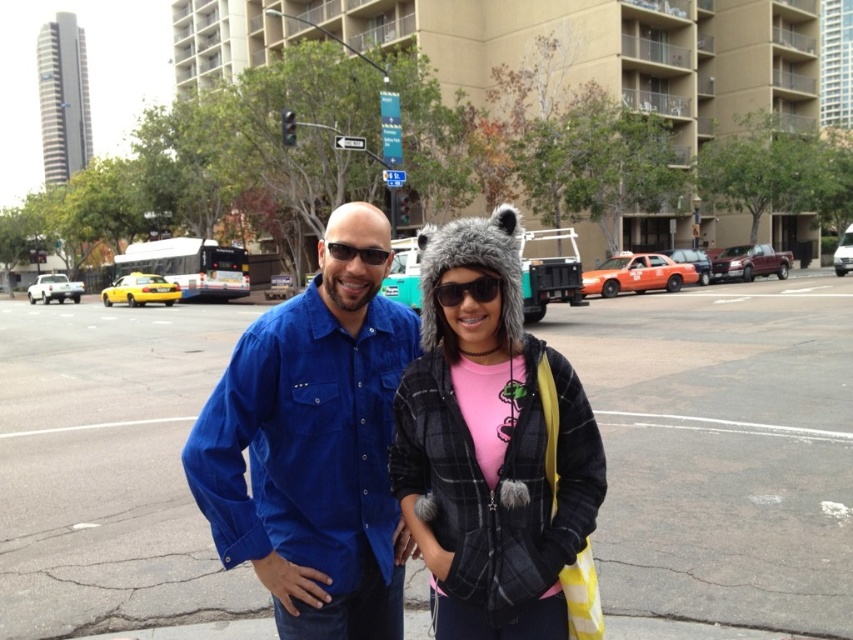
The height and width of the screenshot is (640, 853). What do you see at coordinates (314, 445) in the screenshot?
I see `blue corduroy shirt at center` at bounding box center [314, 445].

Does blue corduroy shirt at center have a smaller size compared to plaid fleece jacket at center?

Incorrect, blue corduroy shirt at center is not smaller in size than plaid fleece jacket at center.

Where is `blue corduroy shirt at center`? The height and width of the screenshot is (640, 853). blue corduroy shirt at center is located at coordinates (314, 445).

Which of these two, plaid fleece jacket at center or matte black sunglasses at center, stands shorter?

With less height is matte black sunglasses at center.

Is the position of plaid fleece jacket at center more distant than that of matte black sunglasses at center?

No, plaid fleece jacket at center is closer to the viewer.

Identify the location of plaid fleece jacket at center. Image resolution: width=853 pixels, height=640 pixels. (492, 451).

Does blue corduroy shirt at center appear on the left side of matte black sunglasses at center?

Indeed, blue corduroy shirt at center is positioned on the left side of matte black sunglasses at center.

Does blue corduroy shirt at center lie behind matte black sunglasses at center?

No, it is in front of matte black sunglasses at center.

Who is more forward, (x=393, y=305) or (x=334, y=243)?

Point (x=334, y=243)

Identify the location of blue corduroy shirt at center. The height and width of the screenshot is (640, 853). (314, 445).